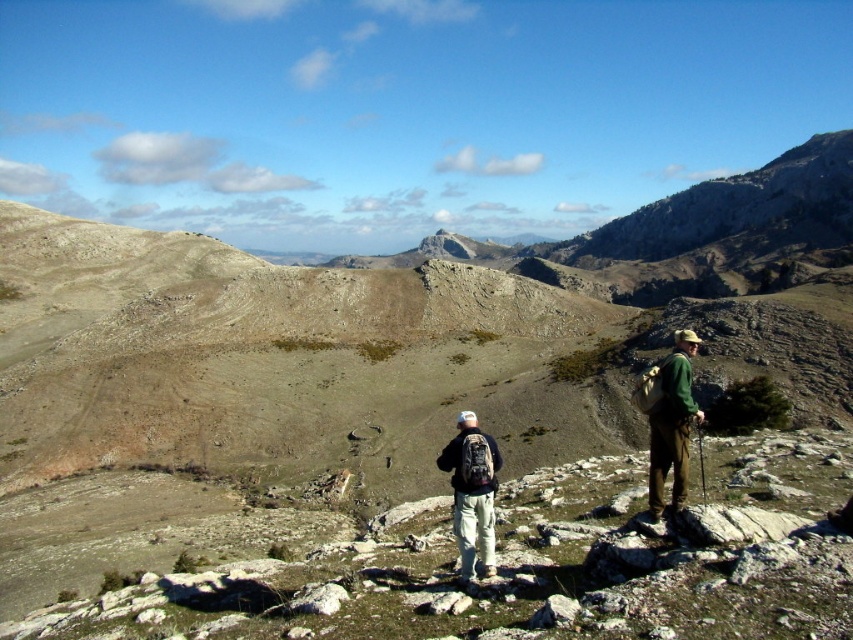
You are a hiker planning to carry both the green fabric backpack at right and the dark gray backpack at center. Which backpack has a greater height?

The green fabric backpack at right is much taller than the dark gray backpack at center, so it has a greater height.

You are a hiker planning to carry both the green fabric backpack at right and the dark gray backpack at center. Which backpack has a larger capacity?

The green fabric backpack at right has a larger capacity than the dark gray backpack at center because it is bigger.

You are a hiker planning to move from the green fabric backpack at right to the dark gray backpack at center. Which backpack is closer to you as you start your journey?

The green fabric backpack at right is closer to you since it is further to the viewer than the dark gray backpack at center, meaning you start near it and need to move towards the one further away.